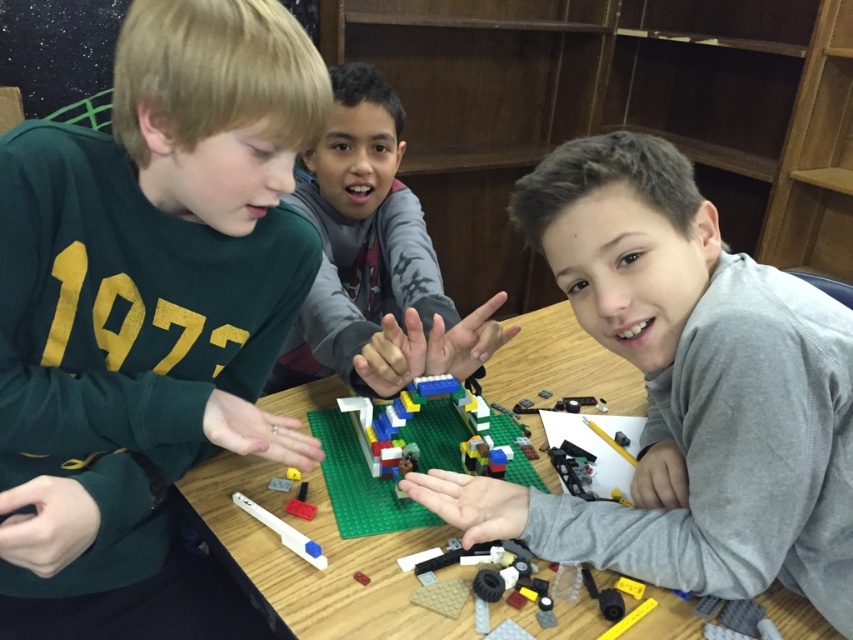
Question: Is green plastic table at center closer to camera compared to matte gray sweater at center?

Choices:
 (A) yes
 (B) no

Answer: (A)

Question: Which object is farther from the camera taking this photo?

Choices:
 (A) multicolored plastic lego structure at center
 (B) green plastic table at center

Answer: (A)

Question: Is green matte shirt at left positioned in front of green plastic table at center?

Choices:
 (A) yes
 (B) no

Answer: (A)

Question: Is gray matte shirt at center positioned before matte gray sweater at center?

Choices:
 (A) yes
 (B) no

Answer: (A)

Question: Among these points, which one is nearest to the camera?

Choices:
 (A) (125, 572)
 (B) (651, 576)
 (C) (395, 264)
 (D) (242, 506)

Answer: (B)

Question: Which object is the closest to the multicolored plastic lego structure at center?

Choices:
 (A) matte gray sweater at center
 (B) green matte shirt at left

Answer: (A)